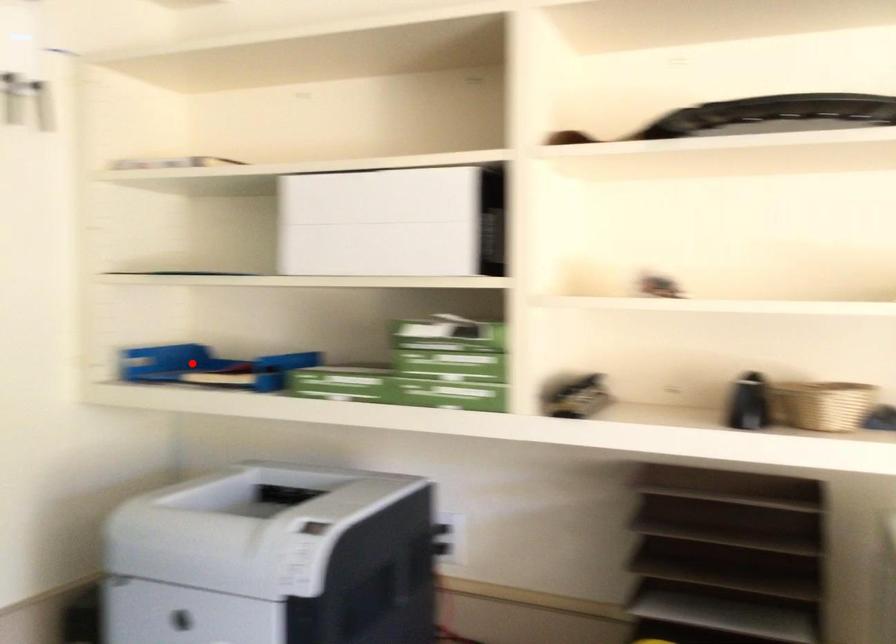
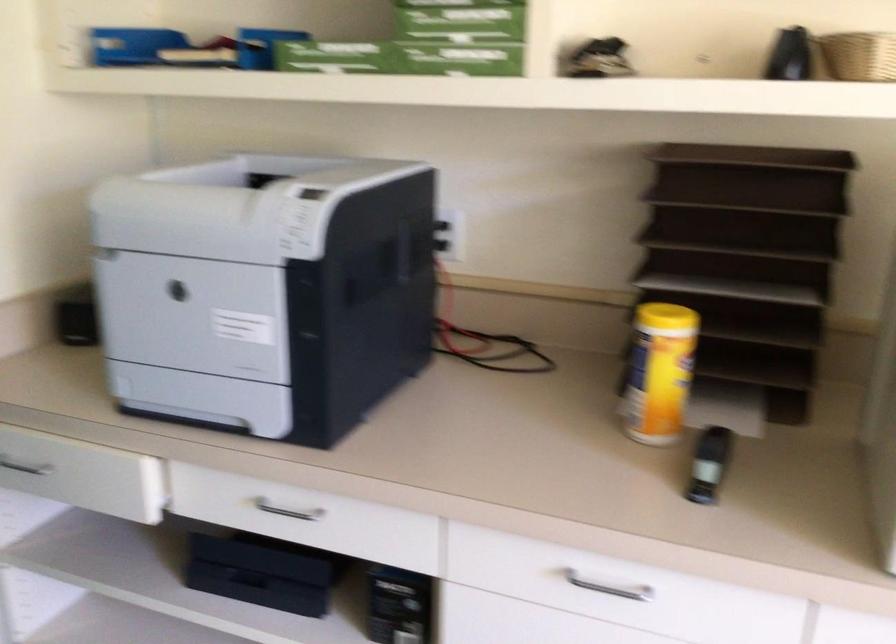
Question: I am providing you with two images of the same scene from different viewpoints. A red point is marked on the first image. At the location where the point appears in image 1, is it still visible in image 2?

Choices:
 (A) Yes
 (B) No

Answer: (A)